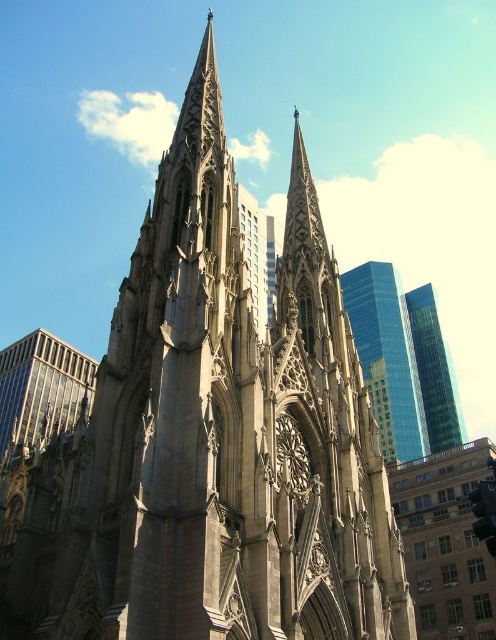
Question: Is glassy blue skyscraper at upper right closer to camera compared to green glass skyscraper at upper right?

Choices:
 (A) no
 (B) yes

Answer: (B)

Question: Estimate the real-world distances between objects in this image. Which object is farther from the glassy reflective skyscraper at left?

Choices:
 (A) green glass skyscraper at upper right
 (B) glassy blue skyscraper at upper right

Answer: (A)

Question: Can you confirm if glassy blue skyscraper at upper right is positioned to the right of glassy reflective skyscraper at left?

Choices:
 (A) no
 (B) yes

Answer: (B)

Question: Which object is the farthest from the glassy blue skyscraper at upper right?

Choices:
 (A) green glass skyscraper at upper right
 (B) glassy reflective skyscraper at left

Answer: (B)

Question: Does glassy blue skyscraper at upper right have a lesser width compared to green glass skyscraper at upper right?

Choices:
 (A) yes
 (B) no

Answer: (B)

Question: Which of the following is the farthest from the observer?

Choices:
 (A) green glass skyscraper at upper right
 (B) glassy reflective skyscraper at left

Answer: (A)